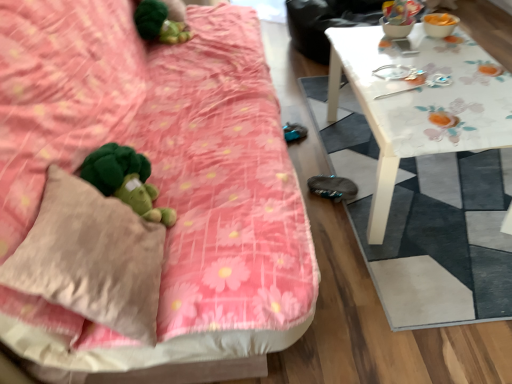
What is the approximate height of white floral-patterned mat at right?

1.73 centimeters.

This screenshot has height=384, width=512. Identify the location of white floral-patterned mat at right. (426, 223).

The image size is (512, 384). What do you see at coordinates (160, 23) in the screenshot?
I see `green plush toy at upper left` at bounding box center [160, 23].

This screenshot has height=384, width=512. What are the coordinates of `beige fabric pillow at lower left` in the screenshot? It's located at (91, 257).

At what (x,y) coordinates should I click in order to perform the action: click on pink floral fabric couch at center. Please return your answer as a coordinate pair (x, y). Looking at the image, I should click on (167, 160).

From a real-world perspective, is white glossy table at upper right above or below white floral-patterned mat at right?

Clearly, from a real-world perspective, white glossy table at upper right is above white floral-patterned mat at right.

Does white glossy table at upper right have a greater width compared to white floral-patterned mat at right?

In fact, white glossy table at upper right might be narrower than white floral-patterned mat at right.

Considering the positions of point (353, 35) and point (482, 272), is point (353, 35) closer or farther from the camera than point (482, 272)?

Point (353, 35) is positioned farther from the camera compared to point (482, 272).

Which is in front, white glossy table at upper right or white floral-patterned mat at right?

white glossy table at upper right is closer to the camera.

From a real-world perspective, which object stands above the other?

From a 3D spatial view, green plush toy at upper left is above.

In the scene shown: Considering the sizes of objects green plush toy at lower left and green plush toy at upper left in the image provided, who is taller, green plush toy at lower left or green plush toy at upper left?

Standing taller between the two is green plush toy at lower left.

From the image's perspective, who appears lower, green plush toy at lower left or green plush toy at upper left?

green plush toy at lower left appears lower in the image.

Between green plush toy at lower left and green plush toy at upper left, which one has smaller width?

Thinner between the two is green plush toy at lower left.

Is green plush toy at lower left at the right side of white floral-patterned mat at right?

In fact, green plush toy at lower left is to the left of white floral-patterned mat at right.

Is green plush toy at lower left positioned in front of white floral-patterned mat at right?

Yes, it is.

Is point (124, 154) positioned before point (434, 232)?

Yes, it is.

Is green plush toy at lower left outside of white floral-patterned mat at right?

green plush toy at lower left lies outside white floral-patterned mat at right's area.

Is green plush toy at upper left to the left or to the right of pink floral fabric couch at center in the image?

green plush toy at upper left is to the left of pink floral fabric couch at center.

From the image's perspective, is green plush toy at upper left under pink floral fabric couch at center?

Answer: No, from the image's perspective, green plush toy at upper left is not below pink floral fabric couch at center.

Is pink floral fabric couch at center located within green plush toy at upper left?

No.

From a real-world perspective, between green plush toy at upper left and pink floral fabric couch at center, who is vertically lower?

pink floral fabric couch at center is physically lower.

Is white floral-patterned mat at right not close to green plush toy at upper left?

Yes, white floral-patterned mat at right is far from green plush toy at upper left.

Is white floral-patterned mat at right outside of green plush toy at upper left?

Indeed, white floral-patterned mat at right is completely outside green plush toy at upper left.

From a real-world perspective, between white floral-patterned mat at right and green plush toy at upper left, who is vertically lower?

In real-world perspective, white floral-patterned mat at right is lower.

Between point (431, 223) and point (180, 22), which one is positioned in front?

The point (431, 223) is closer.

Which object is more forward, pink floral fabric couch at center or green plush toy at upper left?

pink floral fabric couch at center is closer to the camera.

Considering the points (227, 17) and (170, 17), which point is in front, point (227, 17) or point (170, 17)?

Positioned in front is point (170, 17).

From a real-world perspective, is green plush toy at lower left positioned above or below white glossy table at upper right?

green plush toy at lower left is situated higher than white glossy table at upper right in the real world.

Visually, is green plush toy at lower left positioned to the left or to the right of white glossy table at upper right?

green plush toy at lower left is to the left of white glossy table at upper right.

Which object is more forward, green plush toy at lower left or white glossy table at upper right?

Positioned in front is green plush toy at lower left.

Considering the sizes of objects green plush toy at lower left and white glossy table at upper right in the image provided, who is thinner, green plush toy at lower left or white glossy table at upper right?

With smaller width is green plush toy at lower left.

What are the coordinates of `table that is in front of the white floral-patterned mat at right` in the screenshot? It's located at (419, 103).

At what (x,y) coordinates should I click in order to perform the action: click on toy below the green plush toy at upper left (from the image's perspective). Please return your answer as a coordinate pair (x, y). The height and width of the screenshot is (384, 512). Looking at the image, I should click on (126, 180).

Estimate the real-world distances between objects in this image. Which object is closer to green plush toy at upper left, pink floral fabric couch at center or beige fabric pillow at lower left?

Based on the image, pink floral fabric couch at center appears to be nearer to green plush toy at upper left.

Considering their positions, is green plush toy at lower left positioned closer to pink floral fabric couch at center than white floral-patterned mat at right?

Based on the image, green plush toy at lower left appears to be nearer to pink floral fabric couch at center.

When comparing their distances from green plush toy at lower left, does white floral-patterned mat at right or pink floral fabric couch at center seem closer?

Based on the image, pink floral fabric couch at center appears to be nearer to green plush toy at lower left.

From the image, which object appears to be farther from pink floral fabric couch at center, green plush toy at upper left or white glossy table at upper right?

green plush toy at upper left is further to pink floral fabric couch at center.

Which object lies further to the anchor point white floral-patterned mat at right, pink floral fabric couch at center or white glossy table at upper right?

pink floral fabric couch at center is positioned further to the anchor white floral-patterned mat at right.

Which object lies nearer to the anchor point pink floral fabric couch at center, white glossy table at upper right or green plush toy at lower left?

green plush toy at lower left is positioned closer to the anchor pink floral fabric couch at center.

Which object lies nearer to the anchor point white floral-patterned mat at right, beige fabric pillow at lower left or white glossy table at upper right?

white glossy table at upper right is positioned closer to the anchor white floral-patterned mat at right.

From the image, which object appears to be nearer to white glossy table at upper right, green plush toy at upper left or pink floral fabric couch at center?

The object closer to white glossy table at upper right is pink floral fabric couch at center.

At what (x,y) coordinates should I click in order to perform the action: click on table between pink floral fabric couch at center and white floral-patterned mat at right from left to right. Please return your answer as a coordinate pair (x, y). Looking at the image, I should click on (419, 103).

Where is `throw pillow between green plush toy at upper left and white glossy table at upper right from left to right`? throw pillow between green plush toy at upper left and white glossy table at upper right from left to right is located at coordinates (91, 257).

Locate an element on the screen. Image resolution: width=512 pixels, height=384 pixels. toy between beige fabric pillow at lower left and white glossy table at upper right from left to right is located at coordinates (126, 180).

At what (x,y) coordinates should I click in order to perform the action: click on toy located between green plush toy at upper left and white floral-patterned mat at right in the left-right direction. Please return your answer as a coordinate pair (x, y). The height and width of the screenshot is (384, 512). Looking at the image, I should click on pyautogui.click(x=126, y=180).